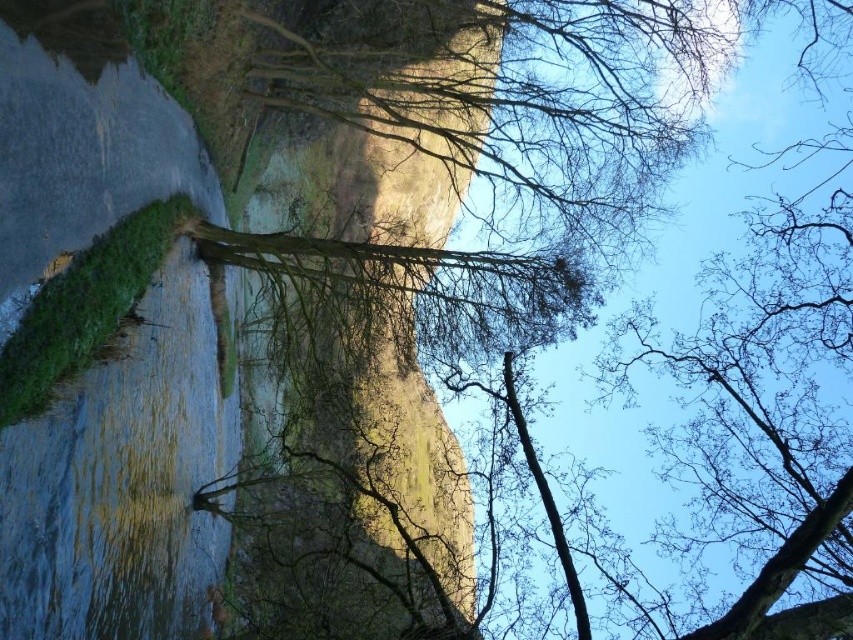
The height and width of the screenshot is (640, 853). In order to click on rustic stone cliff at center in this screenshot , I will do `click(352, 328)`.

Find the location of a particular element. rustic stone cliff at center is located at coordinates (352, 328).